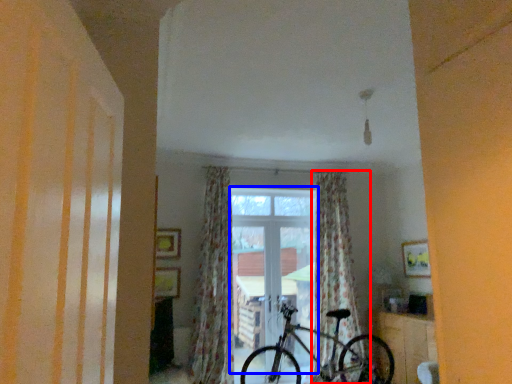
Question: Which point is further to the camera, curtain (highlighted by a red box) or window (highlighted by a blue box)?

Choices:
 (A) curtain
 (B) window

Answer: (B)